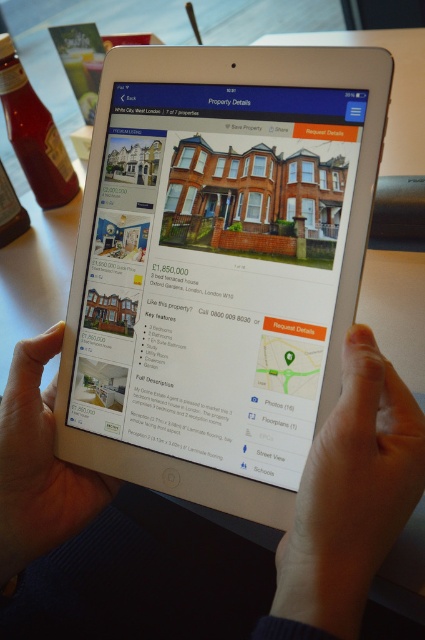
Question: Considering the relative positions of white matte skin at center and smooth skin hand at lower center in the image provided, where is white matte skin at center located with respect to smooth skin hand at lower center?

Choices:
 (A) below
 (B) above

Answer: (A)

Question: Which object appears farthest from the camera in this image?

Choices:
 (A) white plastic tablet at center
 (B) smooth skin hand at lower center
 (C) white matte skin at center

Answer: (A)

Question: Which point appears closest to the camera in this image?

Choices:
 (A) (192, 289)
 (B) (119, 538)
 (C) (333, 560)

Answer: (C)

Question: Is smooth skin hand at lower center smaller than skinny white hand at lower center?

Choices:
 (A) no
 (B) yes

Answer: (A)

Question: Which point is closer to the camera taking this photo?

Choices:
 (A) (118, 484)
 (B) (50, 488)
 (C) (59, 372)
 (D) (317, 504)

Answer: (D)

Question: Is white matte skin at center to the left of smooth skin hand at lower center from the viewer's perspective?

Choices:
 (A) no
 (B) yes

Answer: (B)